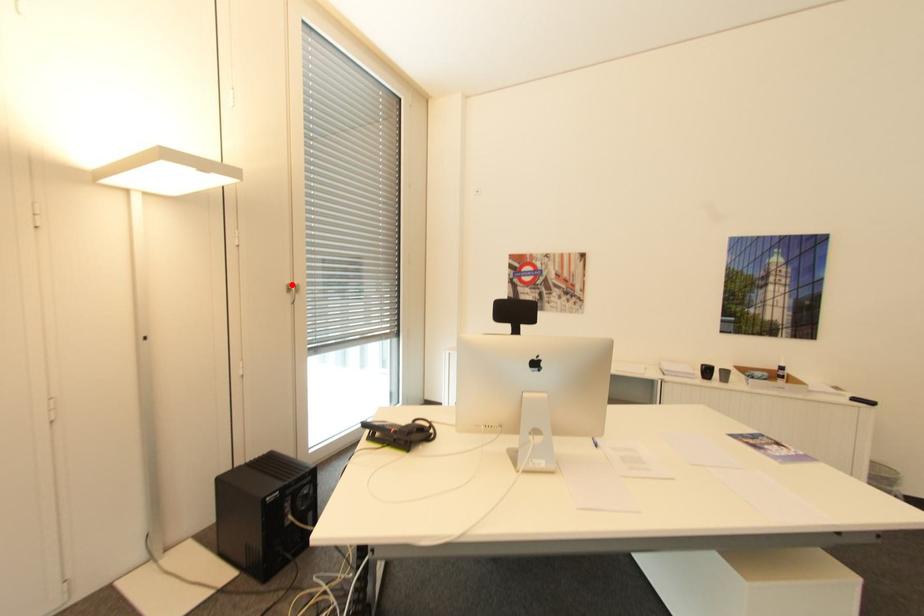
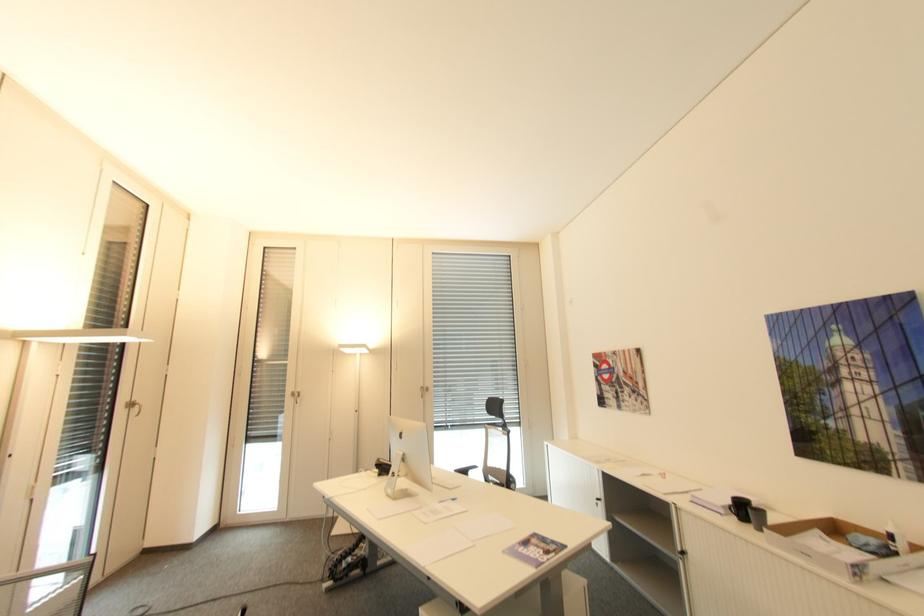
Find the pixel in the second image that matches the highlighted location in the first image.

(427, 387)